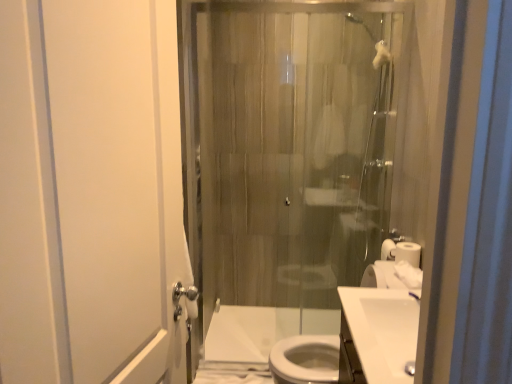
Question: Is the position of white glossy sink at lower right, which is the second sink from back to front, more distant than that of translucent glass shower door at center?

Choices:
 (A) yes
 (B) no

Answer: (B)

Question: Is white glossy sink at lower right, which is the second sink from back to front, bigger than translucent glass shower door at center?

Choices:
 (A) yes
 (B) no

Answer: (B)

Question: Is white glossy sink at lower right, the first sink positioned from the front, smaller than translucent glass shower door at center?

Choices:
 (A) yes
 (B) no

Answer: (A)

Question: From a real-world perspective, is white glossy sink at lower right, the first sink positioned from the front, physically above translucent glass shower door at center?

Choices:
 (A) yes
 (B) no

Answer: (B)

Question: From the image's perspective, is white glossy sink at lower right, which is the second sink from back to front, on top of translucent glass shower door at center?

Choices:
 (A) no
 (B) yes

Answer: (A)

Question: Is point (74, 259) positioned closer to the camera than point (279, 316)?

Choices:
 (A) closer
 (B) farther

Answer: (A)

Question: Considering the positions of white matte screen door at left and white glossy toilet at lower center in the image, is white matte screen door at left wider or thinner than white glossy toilet at lower center?

Choices:
 (A) wide
 (B) thin

Answer: (B)

Question: Would you say white matte screen door at left is inside or outside white glossy toilet at lower center?

Choices:
 (A) outside
 (B) inside

Answer: (A)

Question: From their relative heights in the image, would you say white matte screen door at left is taller or shorter than white glossy toilet at lower center?

Choices:
 (A) short
 (B) tall

Answer: (B)

Question: Which is correct: white matte screen door at left is inside white glossy sink at center, which is the 2th sink from front to back, or outside of it?

Choices:
 (A) outside
 (B) inside

Answer: (A)

Question: From a real-world perspective, is white matte screen door at left above or below white glossy sink at center, which is the 2th sink from front to back?

Choices:
 (A) above
 (B) below

Answer: (A)

Question: Considering the positions of white matte screen door at left and white glossy sink at center, which is the 2th sink from front to back, in the image, is white matte screen door at left wider or thinner than white glossy sink at center, which is the 2th sink from front to back,?

Choices:
 (A) wide
 (B) thin

Answer: (B)

Question: Considering the positions of point (55, 3) and point (396, 291), is point (55, 3) closer or farther from the camera than point (396, 291)?

Choices:
 (A) farther
 (B) closer

Answer: (B)

Question: Considering the positions of point (389, 347) and point (352, 324), is point (389, 347) closer or farther from the camera than point (352, 324)?

Choices:
 (A) farther
 (B) closer

Answer: (A)

Question: Based on their sizes in the image, would you say white glossy sink at center, which appears as the 1th sink when viewed from the back, is bigger or smaller than white glossy sink at lower right, which is the second sink from back to front?

Choices:
 (A) big
 (B) small

Answer: (A)